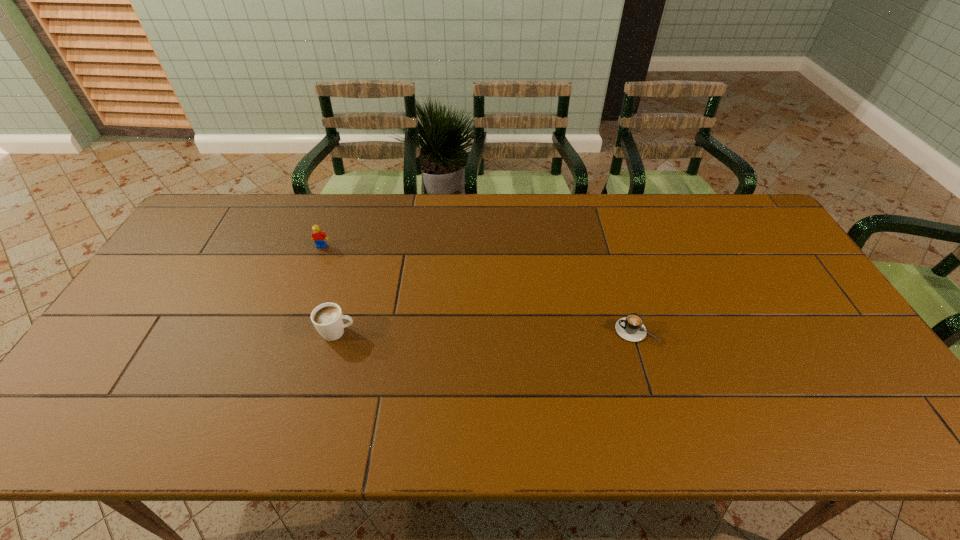
This screenshot has height=540, width=960. What are the coordinates of `empty space that is in between the rightmost object and the taller cappuccino` in the screenshot? It's located at (487, 331).

Find the location of a particular element. The image size is (960, 540). vacant point located between the Lego and the taller cappuccino is located at coordinates (329, 289).

What are the coordinates of `free space between the taller cappuccino and the leftmost object` in the screenshot? It's located at (329, 289).

This screenshot has width=960, height=540. Find the location of `free space that is in between the right cappuccino and the left cappuccino`. free space that is in between the right cappuccino and the left cappuccino is located at coordinates (487, 331).

This screenshot has height=540, width=960. In order to click on vacant space that is in between the leftmost object and the taller cappuccino in this screenshot , I will do `click(329, 289)`.

Where is `free point between the farthest object and the taller cappuccino`? The width and height of the screenshot is (960, 540). free point between the farthest object and the taller cappuccino is located at coordinates (329, 289).

Identify the location of vacant point located between the rightmost object and the second object from right to left. (487, 331).

Locate which object is the closest to the right cappuccino. Please provide its 2D coordinates. Your answer should be formatted as a tuple, i.e. [(x, y)], where the tuple contains the x and y coordinates of a point satisfying the conditions above.

[(328, 319)]

You are a GUI agent. You are given a task and a screenshot of the screen. Output one action in this format:
    pyautogui.click(x=<x>, y=<y>)
    Task: Click on the object that is the second closest to the Lego
    This screenshot has height=540, width=960.
    Given the screenshot: What is the action you would take?
    pyautogui.click(x=631, y=328)